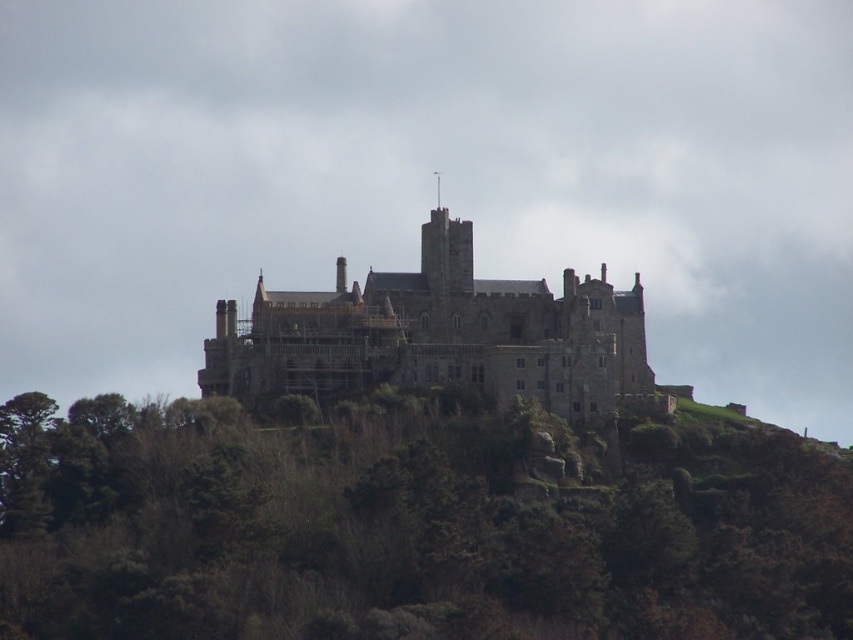
Can you confirm if green leafy tree at center is wider than stone castle at center?

Yes, green leafy tree at center is wider than stone castle at center.

Is point (216, 417) more distant than point (506, 326)?

No, it is in front of (506, 326).

This screenshot has height=640, width=853. Find the location of `green leafy tree at center`. green leafy tree at center is located at coordinates (409, 529).

This screenshot has height=640, width=853. Identify the location of green leafy tree at center. (409, 529).